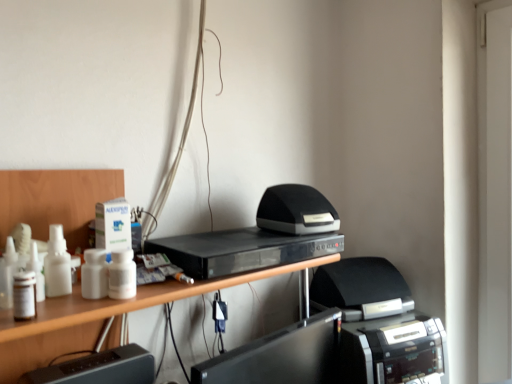
Question: Is black matte speaker at center, the first printer positioned from the top, wider or thinner than black plastic register at lower left, the first register positioned from the left?

Choices:
 (A) thin
 (B) wide

Answer: (B)

Question: Is black matte speaker at center, which ranks as the second printer in bottom-to-top order, spatially inside black plastic register at lower left, the first register positioned from the left, or outside of it?

Choices:
 (A) outside
 (B) inside

Answer: (A)

Question: Estimate the real-world distances between objects in this image. Which object is closer to the black plastic register at lower left, acting as the 2th register starting from the right?

Choices:
 (A) black plastic dvd player at center
 (B) black matte speaker at center, which ranks as the second printer in bottom-to-top order
 (C) black glossy monitor at lower center, the first register from the right
 (D) black plastic printer at lower right, which is the 1th printer in bottom-to-top order

Answer: (C)

Question: Which is nearer to the black plastic printer at lower right, the second printer viewed from the top?

Choices:
 (A) black glossy monitor at lower center, the first register from the right
 (B) black plastic dvd player at center
 (C) black plastic register at lower left, the first register positioned from the left
 (D) black matte speaker at center, which ranks as the second printer in bottom-to-top order

Answer: (A)